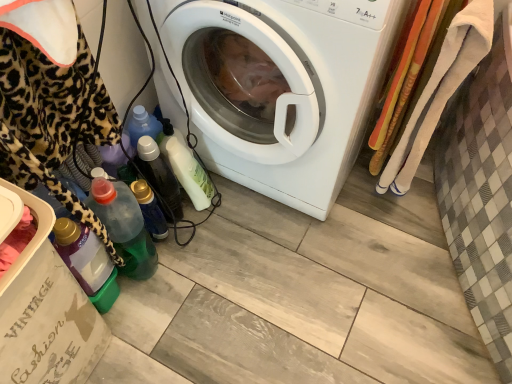
Question: Should I look upward or downward to see translucent plastic bottle at lower center, placed as the 1th bottle when sorted from right to left?

Choices:
 (A) down
 (B) up

Answer: (B)

Question: Considering the relative sizes of white glossy washing machine at center and matte cardboard box at lower left in the image provided, is white glossy washing machine at center wider than matte cardboard box at lower left?

Choices:
 (A) no
 (B) yes

Answer: (B)

Question: From a real-world perspective, does white glossy washing machine at center sit lower than matte cardboard box at lower left?

Choices:
 (A) no
 (B) yes

Answer: (A)

Question: Is white glossy washing machine at center completely or partially outside of matte cardboard box at lower left?

Choices:
 (A) no
 (B) yes

Answer: (B)

Question: From a real-world perspective, is white glossy washing machine at center on matte cardboard box at lower left?

Choices:
 (A) yes
 (B) no

Answer: (A)

Question: Would you say white glossy washing machine at center is a long distance from matte cardboard box at lower left?

Choices:
 (A) no
 (B) yes

Answer: (A)

Question: Is white glossy washing machine at center oriented towards matte cardboard box at lower left?

Choices:
 (A) no
 (B) yes

Answer: (B)

Question: Is translucent plastic bottle at lower center, placed as the 1th bottle when sorted from right to left, at the back of white glossy washing machine at center?

Choices:
 (A) yes
 (B) no

Answer: (B)

Question: Is white glossy washing machine at center to the right of translucent plastic bottle at lower center, placed as the 1th bottle when sorted from right to left, from the viewer's perspective?

Choices:
 (A) no
 (B) yes

Answer: (B)

Question: From the image's perspective, is white glossy washing machine at center under translucent plastic bottle at lower center, placed as the 1th bottle when sorted from right to left?

Choices:
 (A) no
 (B) yes

Answer: (A)

Question: Does white glossy washing machine at center have a greater height compared to translucent plastic bottle at lower center, which is counted as the 5th bottle, starting from the left?

Choices:
 (A) yes
 (B) no

Answer: (A)

Question: Is white glossy washing machine at center aimed at translucent plastic bottle at lower center, which is counted as the 5th bottle, starting from the left?

Choices:
 (A) no
 (B) yes

Answer: (B)

Question: From the image's perspective, does white glossy washing machine at center appear higher than translucent plastic bottle at lower center, placed as the 1th bottle when sorted from right to left?

Choices:
 (A) yes
 (B) no

Answer: (A)

Question: Does translucent plastic bottle at lower left, the second bottle positioned from the left, have a greater height compared to green translucent bottle at lower left, which appears as the 5th bottle when viewed from the right?

Choices:
 (A) no
 (B) yes

Answer: (B)